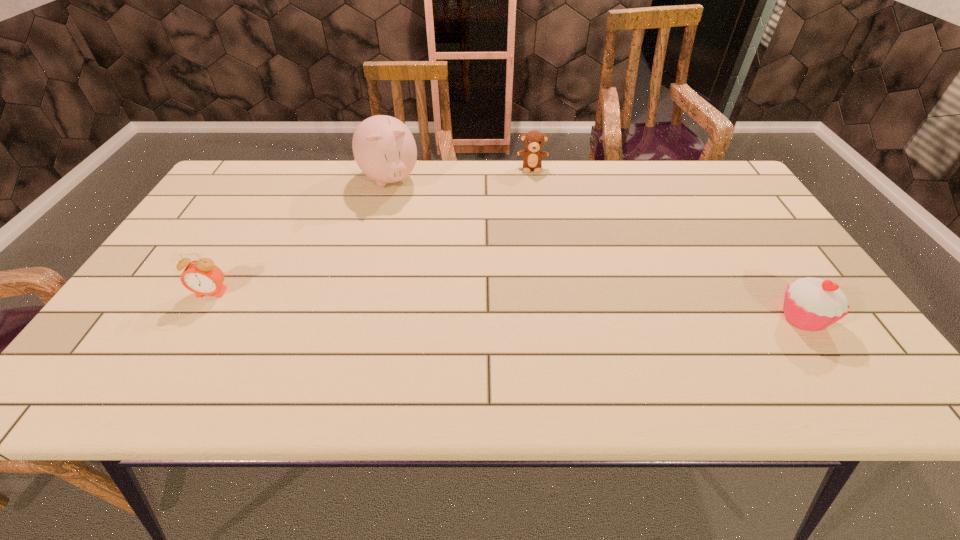
Where is `free space located at the snout of the second object from left to right`? free space located at the snout of the second object from left to right is located at coordinates (427, 257).

This screenshot has height=540, width=960. I want to click on free space located 0.300m at the snout of the second object from left to right, so click(431, 265).

At what (x,y) coordinates should I click in order to perform the action: click on blank area located 0.180m at the snout of the second object from left to right. Please return your answer as a coordinate pair (x, y). The height and width of the screenshot is (540, 960). Looking at the image, I should click on (416, 237).

You are a GUI agent. You are given a task and a screenshot of the screen. Output one action in this format:
    pyautogui.click(x=<x>, y=<y>)
    Task: Click on the teddy bear that is at the far edge
    
    Given the screenshot: What is the action you would take?
    [533, 140]

Locate an element on the screen. piggy bank present at the far edge is located at coordinates (384, 148).

Identify the location of object present at the near edge. The height and width of the screenshot is (540, 960). (812, 304).

Identify the location of object at the left edge. This screenshot has height=540, width=960. (202, 277).

Image resolution: width=960 pixels, height=540 pixels. I want to click on object at the right edge, so click(812, 304).

The width and height of the screenshot is (960, 540). Find the location of `object present at the near right corner`. object present at the near right corner is located at coordinates (812, 304).

The height and width of the screenshot is (540, 960). In order to click on vacant space at the far edge in this screenshot , I will do `click(641, 168)`.